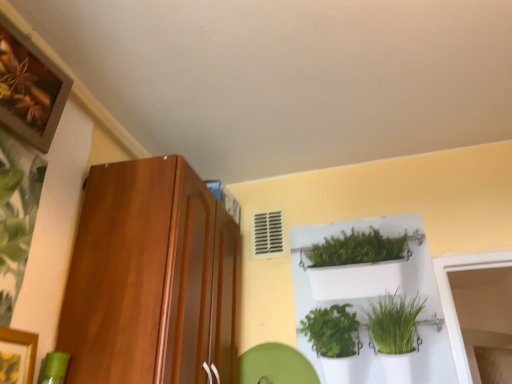
Question: Can you confirm if shiny brown cabinet at left is positioned to the left of green leafy plant at left?

Choices:
 (A) no
 (B) yes

Answer: (A)

Question: Are shiny brown cabinet at left and green leafy plant at left beside each other?

Choices:
 (A) yes
 (B) no

Answer: (B)

Question: Is shiny brown cabinet at left closer to camera compared to green leafy plant at left?

Choices:
 (A) yes
 (B) no

Answer: (B)

Question: Could green leafy plant at left be considered to be inside shiny brown cabinet at left?

Choices:
 (A) no
 (B) yes

Answer: (A)

Question: Does shiny brown cabinet at left have a larger size compared to green leafy plant at left?

Choices:
 (A) yes
 (B) no

Answer: (A)

Question: Would you say green leafy plant at left is inside or outside wooden framed artwork at upper left?

Choices:
 (A) inside
 (B) outside

Answer: (B)

Question: Is point (41, 180) positioned closer to the camera than point (38, 87)?

Choices:
 (A) closer
 (B) farther

Answer: (B)

Question: Is green leafy plant at left bigger or smaller than wooden framed artwork at upper left?

Choices:
 (A) big
 (B) small

Answer: (B)

Question: Considering the positions of green leafy plant at left and wooden framed artwork at upper left in the image, is green leafy plant at left wider or thinner than wooden framed artwork at upper left?

Choices:
 (A) wide
 (B) thin

Answer: (B)

Question: From the image's perspective, is shiny brown cabinet at left positioned above or below white plastic shelf at upper center?

Choices:
 (A) above
 (B) below

Answer: (A)

Question: From a real-world perspective, is shiny brown cabinet at left above or below white plastic shelf at upper center?

Choices:
 (A) above
 (B) below

Answer: (B)

Question: Considering their positions, is shiny brown cabinet at left located in front of or behind white plastic shelf at upper center?

Choices:
 (A) behind
 (B) front

Answer: (B)

Question: Is shiny brown cabinet at left spatially inside white plastic shelf at upper center, or outside of it?

Choices:
 (A) inside
 (B) outside

Answer: (B)

Question: In the image, is shiny brown cabinet at left positioned in front of or behind green leafy plant at left?

Choices:
 (A) behind
 (B) front

Answer: (A)

Question: From their relative heights in the image, would you say shiny brown cabinet at left is taller or shorter than green leafy plant at left?

Choices:
 (A) short
 (B) tall

Answer: (B)